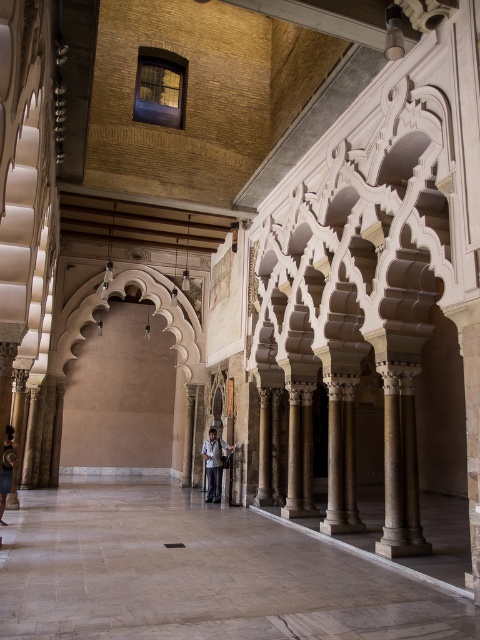
Which is behind, point (131, 596) or point (8, 461)?

The point (8, 461) is behind.

Looking at this image, is brown marble corridor at center thinner than dark gray fabric at lower left?

No, brown marble corridor at center is not thinner than dark gray fabric at lower left.

Which is in front, point (91, 621) or point (12, 429)?

Positioned in front is point (91, 621).

Locate an element on the screen. brown marble corridor at center is located at coordinates (196, 573).

Is point (303, 600) farther from viewer compared to point (217, 492)?

That is False.

Does point (269, 560) come in front of point (212, 483)?

Yes, point (269, 560) is in front of point (212, 483).

At what (x,y) coordinates should I click in order to perform the action: click on brown marble corridor at center. Please return your answer as a coordinate pair (x, y). Looking at the image, I should click on [x=196, y=573].

Who is shorter, dark gray fabric jacket at center or dark gray fabric at lower left?

With less height is dark gray fabric at lower left.

Does dark gray fabric jacket at center appear over dark gray fabric at lower left?

Actually, dark gray fabric jacket at center is below dark gray fabric at lower left.

What do you see at coordinates (214, 465) in the screenshot? I see `dark gray fabric jacket at center` at bounding box center [214, 465].

Locate an element on the screen. dark gray fabric jacket at center is located at coordinates (214, 465).